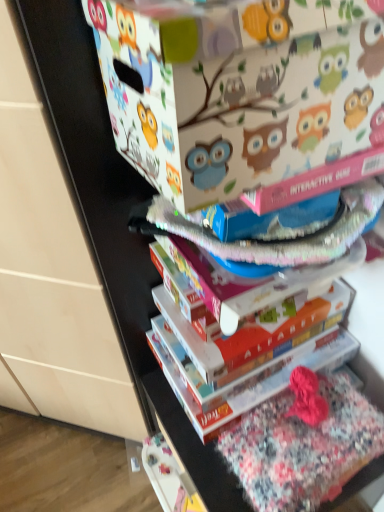
This screenshot has width=384, height=512. Describe the element at coordinates (303, 448) in the screenshot. I see `floral cotton fabric at lower right` at that location.

Where is `hardcover book at center`? This screenshot has width=384, height=512. hardcover book at center is located at coordinates [246, 352].

Would you say floral cotton fabric at lower right is part of hardcover book at center's contents?

No, hardcover book at center does not contain floral cotton fabric at lower right.

Which is more to the right, hardcover book at center or floral cotton fabric at lower right?

floral cotton fabric at lower right.

From the image's perspective, which is below, hardcover book at center or floral cotton fabric at lower right?

From the image's view, floral cotton fabric at lower right is below.

Is the position of hardcover book at center more distant than that of floral cotton fabric at lower right?

Yes, hardcover book at center is further from the camera.

Where is `cardboard box above the floral cotton fabric at lower right (from a real-world perspective)`? Image resolution: width=384 pixels, height=512 pixels. cardboard box above the floral cotton fabric at lower right (from a real-world perspective) is located at coordinates (242, 106).

Considering the points (350, 477) and (326, 81), which point is in front, point (350, 477) or point (326, 81)?

The point (326, 81) is in front.

Based on the photo, could you tell me if floral cotton fabric at lower right is facing matte white cardboard box at upper center?

No.

Looking at the image, does floral cotton fabric at lower right seem bigger or smaller compared to matte white cardboard box at upper center?

floral cotton fabric at lower right is smaller than matte white cardboard box at upper center.

In the scene shown: Could you measure the distance between matte white cardboard box at upper center and floral cotton fabric at lower right?

They are 18.07 inches apart.

Looking at this image, is matte white cardboard box at upper center beside floral cotton fabric at lower right?

matte white cardboard box at upper center is not next to floral cotton fabric at lower right, and they're not touching.

Relative to floral cotton fabric at lower right, is matte white cardboard box at upper center in front or behind?

matte white cardboard box at upper center is in front of floral cotton fabric at lower right.

From a real-world perspective, is matte white cardboard box at upper center positioned above or below floral cotton fabric at lower right?

matte white cardboard box at upper center is above floral cotton fabric at lower right.

Between hardcover book at center and matte white cardboard box at upper center, which one has larger size?

matte white cardboard box at upper center.

Which is more to the left, hardcover book at center or matte white cardboard box at upper center?

Positioned to the left is matte white cardboard box at upper center.

Between hardcover book at center and matte white cardboard box at upper center, which one has smaller width?

With smaller width is matte white cardboard box at upper center.

Which object is wider, matte white cardboard box at upper center or hardcover book at center?

Wider between the two is hardcover book at center.

From the image's perspective, which is below, matte white cardboard box at upper center or hardcover book at center?

From the image's view, hardcover book at center is below.

Can you tell me how much matte white cardboard box at upper center and hardcover book at center differ in facing direction?

matte white cardboard box at upper center and hardcover book at center are facing 0.67 degrees away from each other.

Is matte white cardboard box at upper center with hardcover book at center?

No.

Is floral cotton fabric at lower right aimed at hardcover book at center?

No, floral cotton fabric at lower right is not facing towards hardcover book at center.

How different are the orientations of floral cotton fabric at lower right and hardcover book at center in degrees?

They differ by 4.31e-05 degrees in their facing directions.

Is hardcover book at center located within floral cotton fabric at lower right?

No, hardcover book at center is not a part of floral cotton fabric at lower right.

I want to click on fabric located on the right of hardcover book at center, so click(x=303, y=448).

You are a GUI agent. You are given a task and a screenshot of the screen. Output one action in this format:
    pyautogui.click(x=<x>, y=<y>)
    Task: Click on the book above the floral cotton fabric at lower right (from the image's perspective)
    The width and height of the screenshot is (384, 512).
    Given the screenshot: What is the action you would take?
    pyautogui.click(x=246, y=352)

Image resolution: width=384 pixels, height=512 pixels. I want to click on fabric located underneath the matte white cardboard box at upper center (from a real-world perspective), so click(303, 448).

Estimate the real-world distances between objects in this image. Which object is further from hardcover book at center, matte white cardboard box at upper center or floral cotton fabric at lower right?

matte white cardboard box at upper center lies further to hardcover book at center than the other object.

Considering their positions, is floral cotton fabric at lower right positioned closer to hardcover book at center than matte white cardboard box at upper center?

floral cotton fabric at lower right is closer to hardcover book at center.

In the scene shown: Estimate the real-world distances between objects in this image. Which object is further from floral cotton fabric at lower right, hardcover book at center or matte white cardboard box at upper center?

The object further to floral cotton fabric at lower right is matte white cardboard box at upper center.

In the scene shown: From the image, which object appears to be nearer to matte white cardboard box at upper center, hardcover book at center or floral cotton fabric at lower right?

hardcover book at center.

Considering their positions, is matte white cardboard box at upper center positioned further to floral cotton fabric at lower right than hardcover book at center?

matte white cardboard box at upper center.

Based on their spatial positions, is floral cotton fabric at lower right or hardcover book at center further from matte white cardboard box at upper center?

floral cotton fabric at lower right.

Where is `book that lies between matte white cardboard box at upper center and floral cotton fabric at lower right from top to bottom`? book that lies between matte white cardboard box at upper center and floral cotton fabric at lower right from top to bottom is located at coordinates (246, 352).